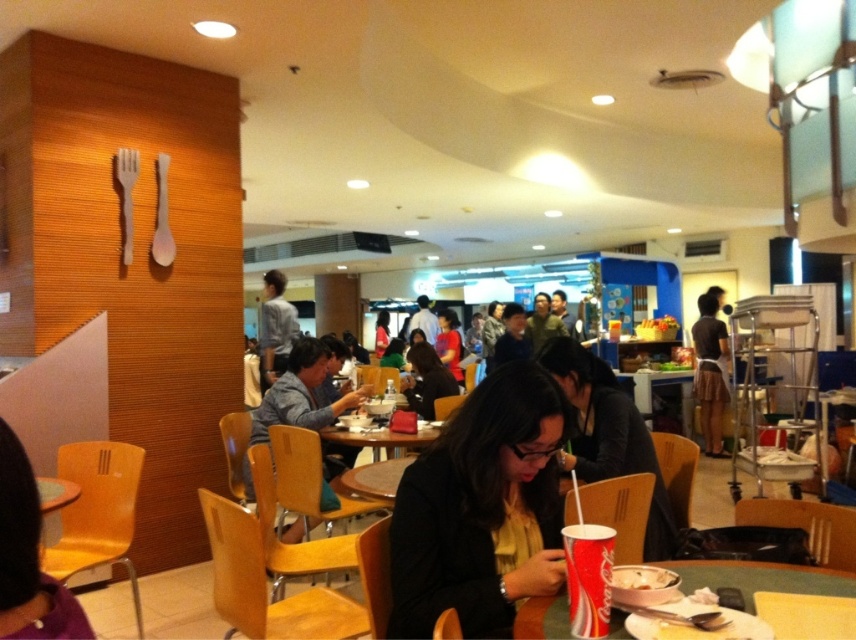
Is point (563, 413) in front of point (415, 408)?

That is True.

Is matte black jacket at center in front of matte black hair at center?

Yes, matte black jacket at center is in front of matte black hair at center.

Is point (528, 451) farther from camera compared to point (409, 397)?

No, (528, 451) is closer to viewer.

What are the coordinates of `matte black jacket at center` in the screenshot? It's located at (480, 508).

Which of these two, matte plastic table at center or matte red cup at lower center, stands taller?

With more height is matte red cup at lower center.

Does matte plastic table at center appear under matte red cup at lower center?

Correct, matte plastic table at center is located below matte red cup at lower center.

Between point (694, 582) and point (580, 593), which one is positioned in front?

Point (580, 593) is more forward.

Image resolution: width=856 pixels, height=640 pixels. What are the coordinates of `matte plastic table at center` in the screenshot? It's located at (761, 577).

Is the position of wooden table at center more distant than that of white paper cup at center?

Yes.

Which is below, wooden table at center or white paper cup at center?

Positioned lower is wooden table at center.

Which is behind, point (351, 444) or point (631, 582)?

The point (351, 444) is more distant.

Image resolution: width=856 pixels, height=640 pixels. Find the location of `wooden table at center`. wooden table at center is located at coordinates (379, 438).